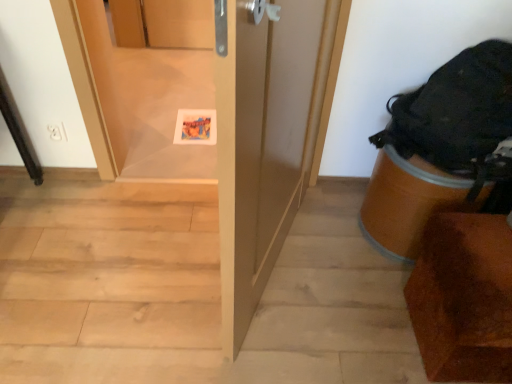
Question: Is point (505, 57) positioned closer to the camera than point (474, 350)?

Choices:
 (A) farther
 (B) closer

Answer: (A)

Question: Looking at their shapes, would you say black fabric backpack at right is wider or thinner than brown wood chair at lower right?

Choices:
 (A) wide
 (B) thin

Answer: (A)

Question: Which is farther from the transparent plastic screen door at center?

Choices:
 (A) brown wood chair at lower right
 (B) black fabric backpack at right
 (C) matte paper postcard at center
 (D) light wood stairwell at center

Answer: (A)

Question: Which object is the closest to the light wood stairwell at center?

Choices:
 (A) black fabric backpack at right
 (B) transparent plastic screen door at center
 (C) brown wood chair at lower right
 (D) matte paper postcard at center

Answer: (C)